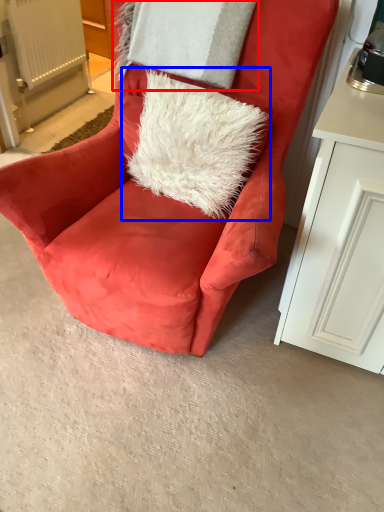
Question: Which point is closer to the camera, pillow (highlighted by a red box) or throw pillow (highlighted by a blue box)?

Choices:
 (A) pillow
 (B) throw pillow

Answer: (B)